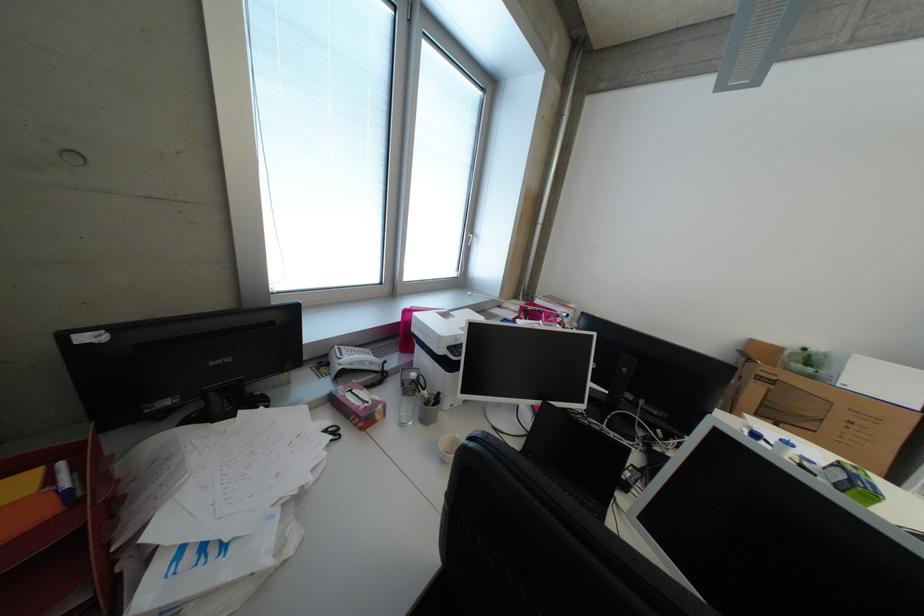
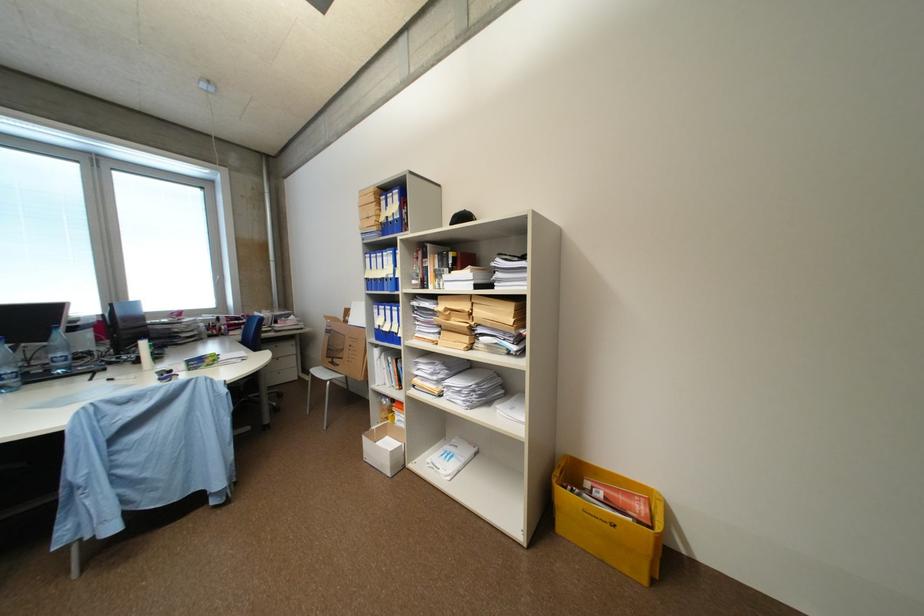
In the second image, find the point that corresponds to point (771, 406) in the first image.

(336, 350)